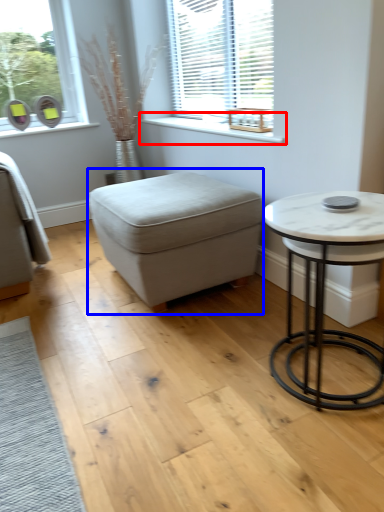
Question: Which of the following is the farthest to the observer, window sill (highlighted by a red box) or music stool (highlighted by a blue box)?

Choices:
 (A) window sill
 (B) music stool

Answer: (A)